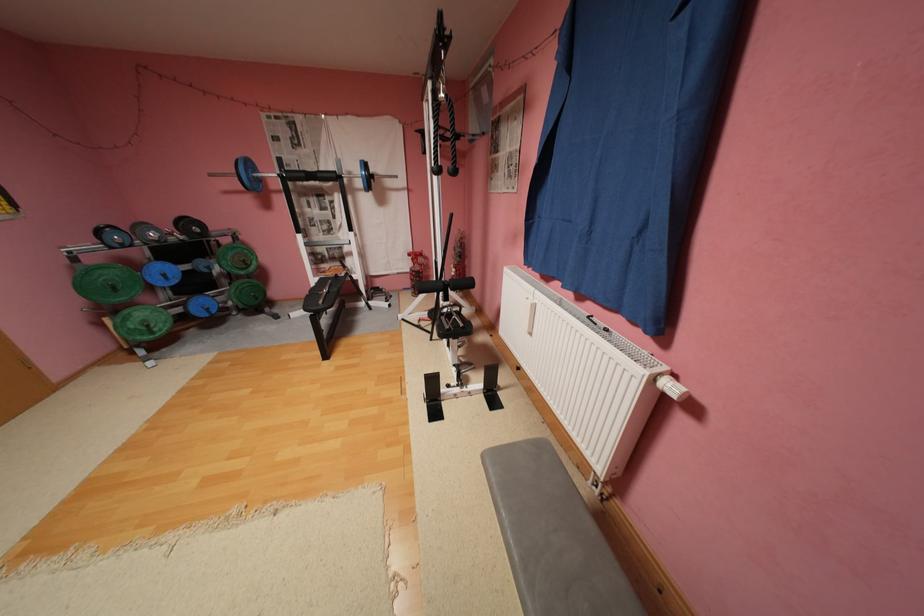
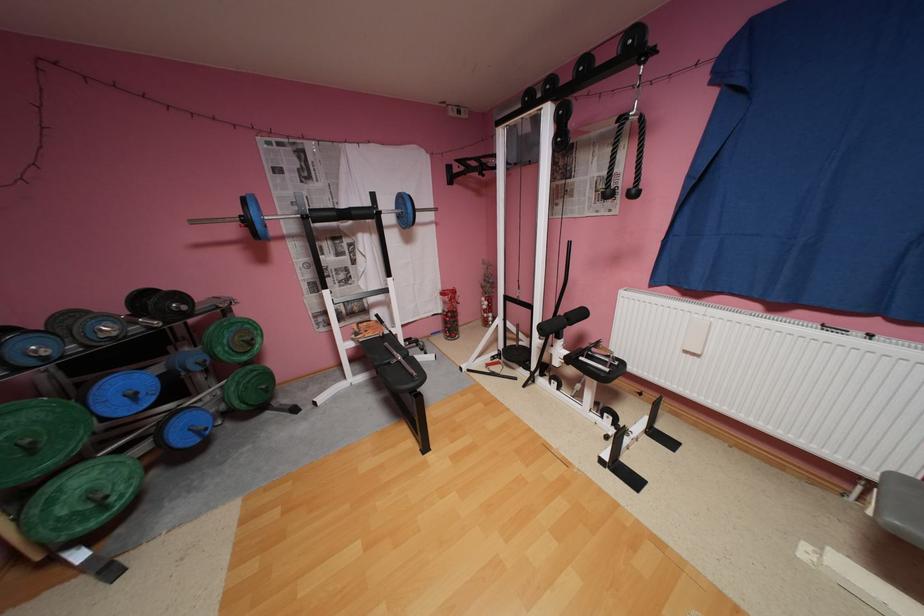
Where in the second image is the point corresponding to point (337, 274) from the first image?

(380, 334)